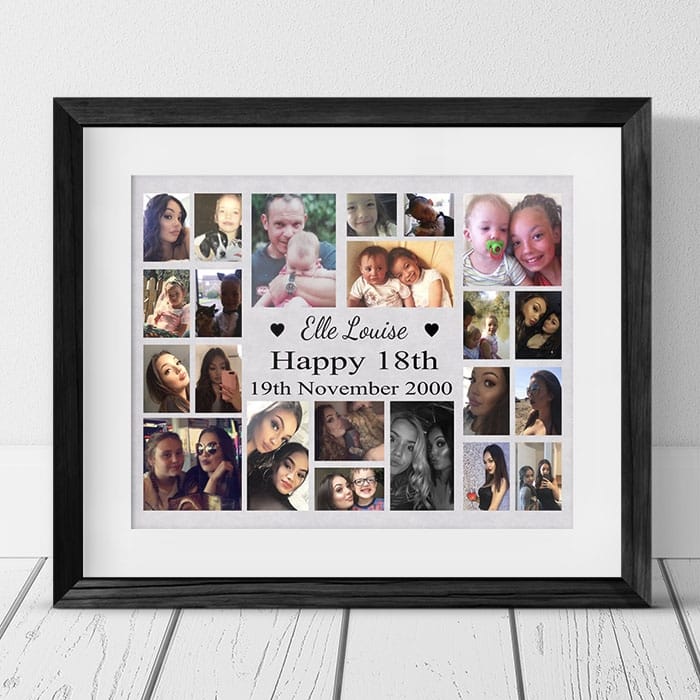
You are a GUI agent. You are given a task and a screenshot of the screen. Output one action in this format:
    pyautogui.click(x=<x>, y=<y>)
    Task: Click on the sides of picture frame
    The image size is (700, 700).
    Given the screenshot: What is the action you would take?
    pyautogui.click(x=410, y=106), pyautogui.click(x=364, y=584), pyautogui.click(x=71, y=447), pyautogui.click(x=634, y=402)